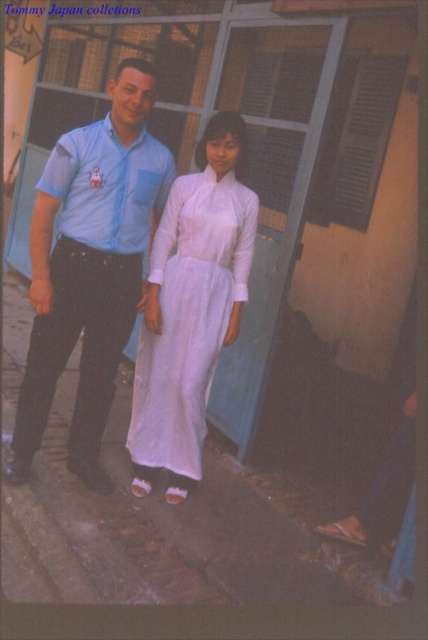
Can you confirm if matte blue shirt at center is taller than white silk dress at center?

Yes.

Describe the element at coordinates (89, 266) in the screenshot. I see `matte blue shirt at center` at that location.

Where is `matte blue shirt at center`? The image size is (428, 640). matte blue shirt at center is located at coordinates (89, 266).

Between white silk dress at center and matte blue shirt at left, which one appears on the right side from the viewer's perspective?

From the viewer's perspective, white silk dress at center appears more on the right side.

Image resolution: width=428 pixels, height=640 pixels. What do you see at coordinates (190, 316) in the screenshot?
I see `white silk dress at center` at bounding box center [190, 316].

Is point (146, 445) positioned in front of point (125, 212)?

No.

The image size is (428, 640). What are the coordinates of `white silk dress at center` in the screenshot? It's located at (190, 316).

Does matte blue shirt at center appear on the left side of matte blue shirt at left?

Yes, matte blue shirt at center is to the left of matte blue shirt at left.

Does matte blue shirt at center appear on the right side of matte blue shirt at left?

In fact, matte blue shirt at center is to the left of matte blue shirt at left.

Locate an element on the screen. matte blue shirt at center is located at coordinates (89, 266).